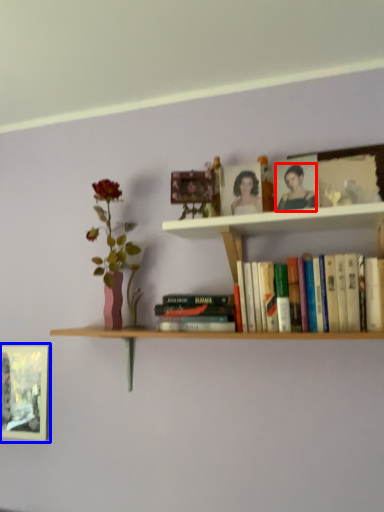
Question: Which of the following is the closest to the observer, person (highlighted by a red box) or picture frame (highlighted by a blue box)?

Choices:
 (A) person
 (B) picture frame

Answer: (A)